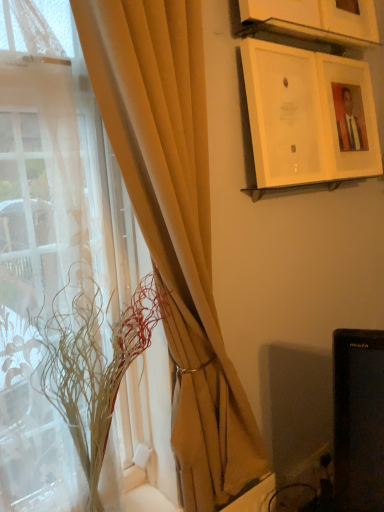
Question: Should I look upward or downward to see translucent glass vase at left?

Choices:
 (A) up
 (B) down

Answer: (B)

Question: Is matte white picture frame at upper right, acting as the second picture frame starting from the bottom, at the left side of matte beige curtain at left?

Choices:
 (A) no
 (B) yes

Answer: (A)

Question: Can we say matte white picture frame at upper right, arranged as the second picture frame when viewed from the top, lies outside matte beige curtain at left?

Choices:
 (A) yes
 (B) no

Answer: (A)

Question: Does matte white picture frame at upper right, arranged as the second picture frame when viewed from the top, have a lesser height compared to matte beige curtain at left?

Choices:
 (A) no
 (B) yes

Answer: (B)

Question: Is matte white picture frame at upper right, acting as the second picture frame starting from the bottom, further to camera compared to matte beige curtain at left?

Choices:
 (A) no
 (B) yes

Answer: (B)

Question: Is matte white picture frame at upper right, arranged as the second picture frame when viewed from the top, facing away from matte beige curtain at left?

Choices:
 (A) yes
 (B) no

Answer: (B)

Question: From a real-world perspective, is matte white picture frame at upper right, arranged as the second picture frame when viewed from the top, physically above matte beige curtain at left?

Choices:
 (A) no
 (B) yes

Answer: (B)

Question: Does translucent fabric at left have a smaller size compared to matte white picture frame at upper right, arranged as the second picture frame when viewed from the top?

Choices:
 (A) no
 (B) yes

Answer: (A)

Question: Is translucent fabric at left not near matte white picture frame at upper right, acting as the second picture frame starting from the bottom?

Choices:
 (A) no
 (B) yes

Answer: (A)

Question: Does translucent fabric at left turn towards matte white picture frame at upper right, acting as the second picture frame starting from the bottom?

Choices:
 (A) no
 (B) yes

Answer: (A)

Question: From the image's perspective, does translucent fabric at left appear higher than matte white picture frame at upper right, arranged as the second picture frame when viewed from the top?

Choices:
 (A) yes
 (B) no

Answer: (B)

Question: Is translucent fabric at left not inside matte white picture frame at upper right, arranged as the second picture frame when viewed from the top?

Choices:
 (A) yes
 (B) no

Answer: (A)

Question: Does translucent fabric at left have a lesser height compared to matte white picture frame at upper right, arranged as the second picture frame when viewed from the top?

Choices:
 (A) no
 (B) yes

Answer: (A)

Question: Is translucent glass vase at left at the right side of matte beige curtain at left?

Choices:
 (A) no
 (B) yes

Answer: (A)